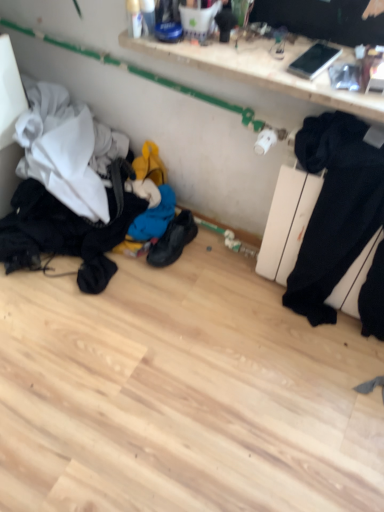
This screenshot has width=384, height=512. What are the coordinates of `free point below black leather shoes at center (from a real-world perspective)` in the screenshot? It's located at (177, 255).